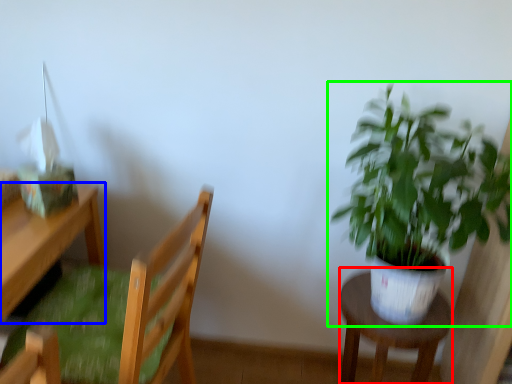
Question: Based on their relative distances, which object is farther from stool (highlighted by a red box)? Choose from desk (highlighted by a blue box) and houseplant (highlighted by a green box).

Choices:
 (A) desk
 (B) houseplant

Answer: (A)